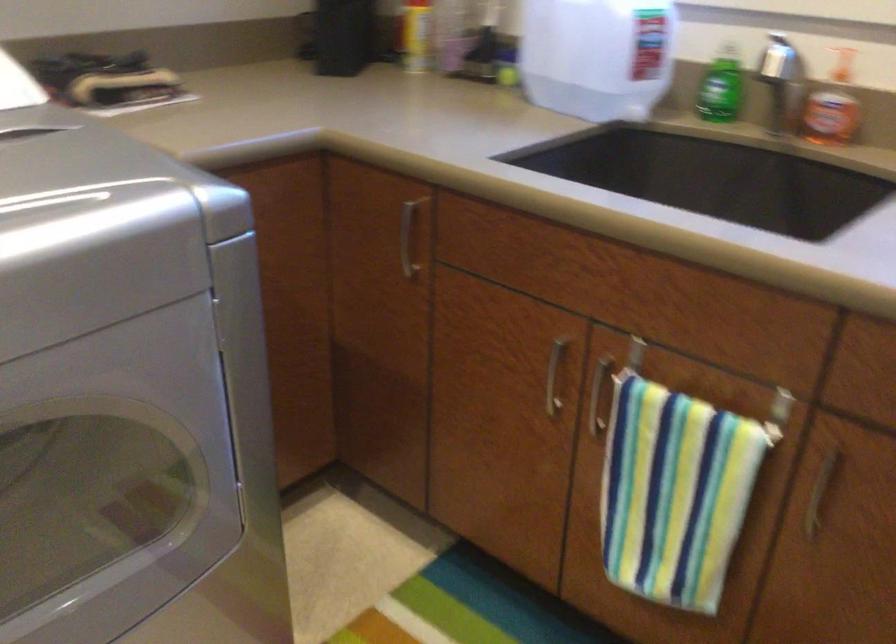
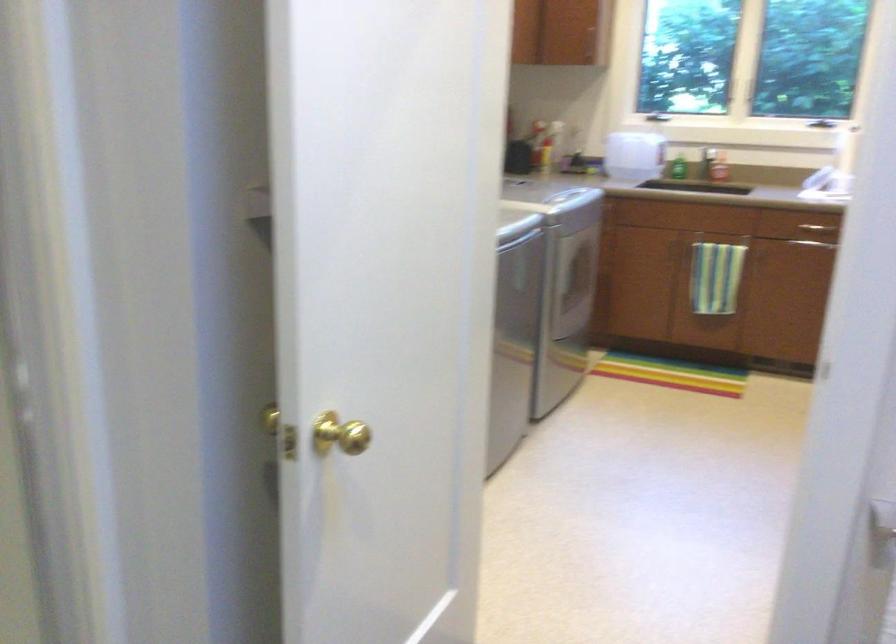
In the second image, find the point that corresponds to (x=556, y=68) in the first image.

(633, 155)